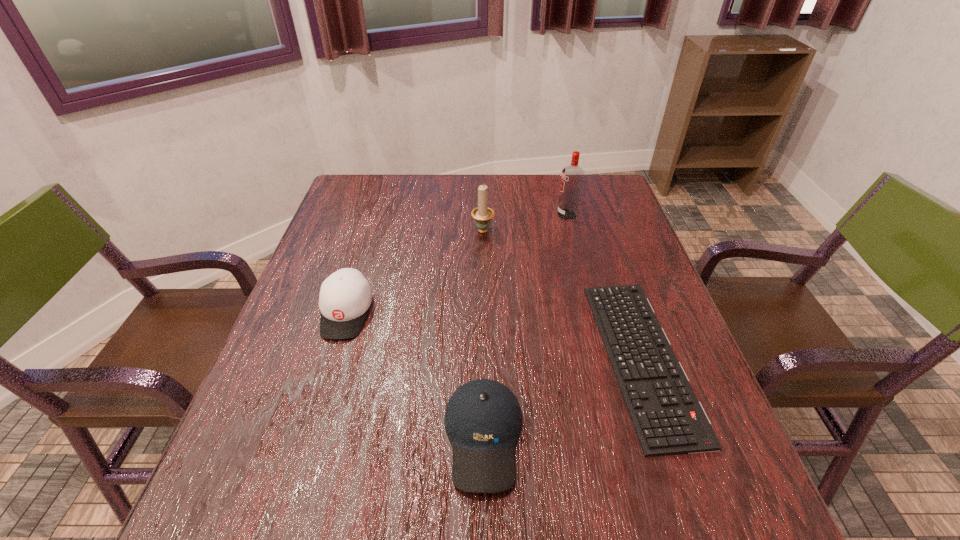
Find the location of a particular element. vodka that is at the right edge is located at coordinates (572, 177).

The height and width of the screenshot is (540, 960). I want to click on computer keyboard at the right edge, so click(x=668, y=419).

Locate an element on the screen. The height and width of the screenshot is (540, 960). object located at the far right corner is located at coordinates (572, 177).

I want to click on free spot at the far edge of the desktop, so click(x=492, y=177).

Locate an element on the screen. The image size is (960, 540). free location at the near edge of the desktop is located at coordinates (490, 531).

The image size is (960, 540). Find the location of `free space at the left edge of the desktop`. free space at the left edge of the desktop is located at coordinates [370, 224].

In the image, there is a desktop. Identify the location of vacant space at the far left corner. The image size is (960, 540). (395, 179).

The width and height of the screenshot is (960, 540). In order to click on vacant space at the near left corner of the desktop in this screenshot , I will do `click(273, 521)`.

Locate an element on the screen. The width and height of the screenshot is (960, 540). free location at the far right corner of the desktop is located at coordinates (605, 209).

This screenshot has width=960, height=540. In order to click on unoccupied area between the nearer baseball cap and the second farthest object in this screenshot , I will do `click(483, 333)`.